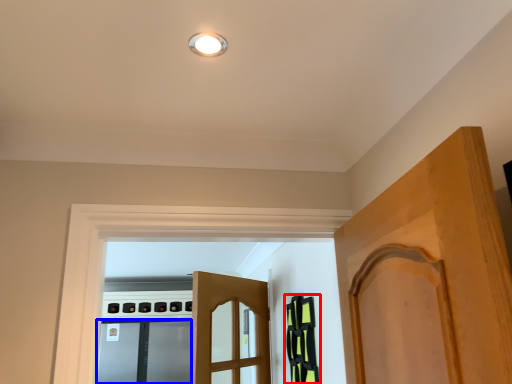
Question: Which of the following is the farthest to the observer, cabinetry (highlighted by a red box) or screen door (highlighted by a blue box)?

Choices:
 (A) cabinetry
 (B) screen door

Answer: (B)